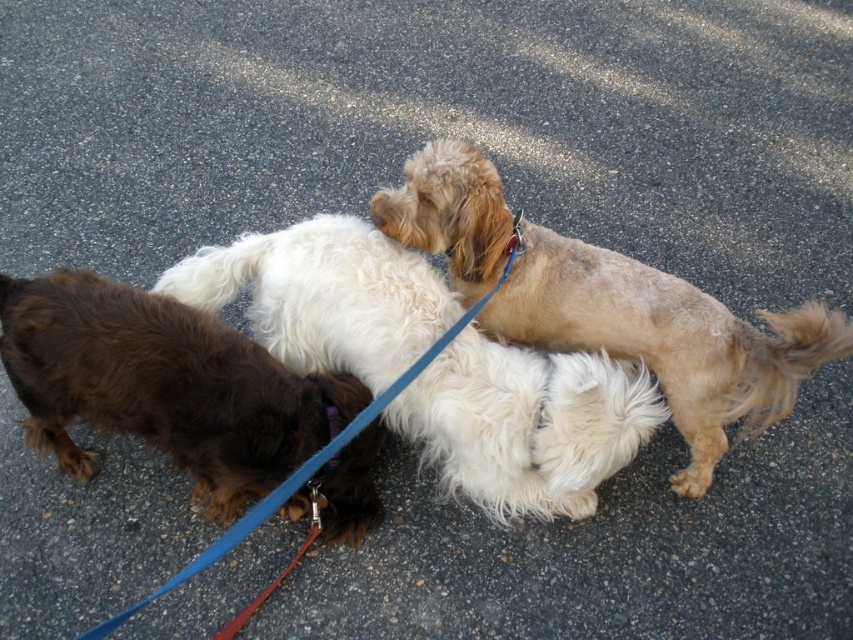
Question: Estimate the real-world distances between objects in this image. Which object is closer to the light brown fur at center?

Choices:
 (A) shiny brown fur at lower left
 (B) fluffy white dog at center
 (C) purple fabric neckband at center

Answer: (B)

Question: Which point is farther from the camera taking this photo?

Choices:
 (A) (592, 460)
 (B) (305, 438)
 (C) (331, 403)

Answer: (C)

Question: Is the position of shiny brown fur at lower left more distant than that of blue nylon leash at center?

Choices:
 (A) yes
 (B) no

Answer: (A)

Question: Which point is farther to the camera?

Choices:
 (A) shiny brown fur at lower left
 (B) purple fabric neckband at center

Answer: (A)

Question: Is fluffy white dog at center smaller than shiny brown fur at lower left?

Choices:
 (A) no
 (B) yes

Answer: (A)

Question: Can you confirm if fluffy white dog at center is smaller than shiny brown fur at lower left?

Choices:
 (A) no
 (B) yes

Answer: (A)